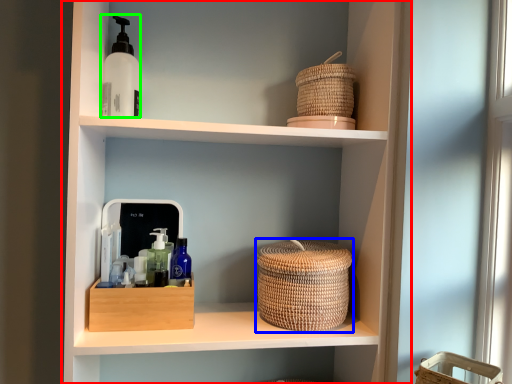
Question: Which is farther away from shelf (highlighted by a red box)? basket container (highlighted by a blue box) or mouthwash (highlighted by a green box)?

Choices:
 (A) basket container
 (B) mouthwash

Answer: (B)